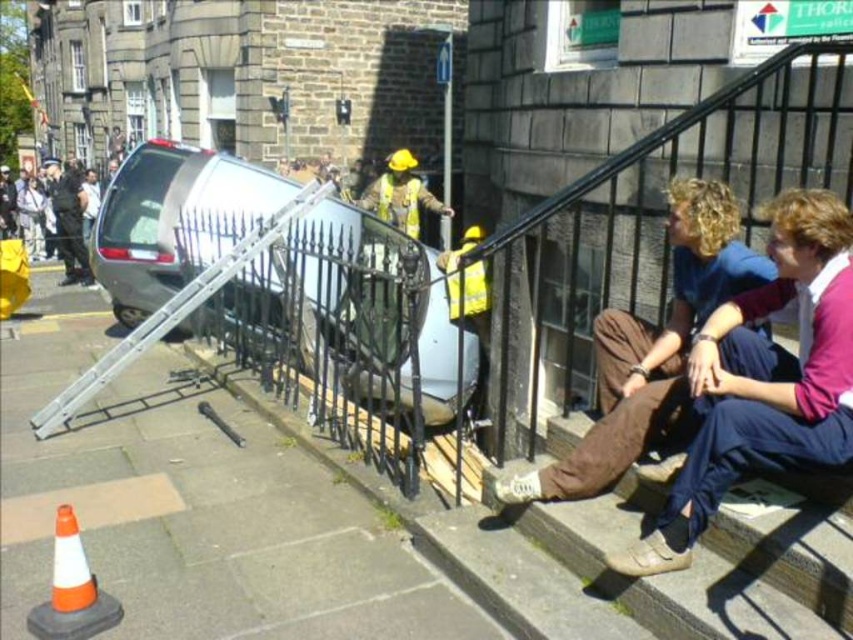
Question: In this image, where is brown fabric pants at lower right located relative to orange/white plastic traffic cone at lower left?

Choices:
 (A) below
 (B) above

Answer: (B)

Question: Which object is positioned farthest from the brown fabric pants at lower right?

Choices:
 (A) orange/white plastic traffic cone at lower left
 (B) brown fabric stairs at lower right
 (C) silver metallic van at center
 (D) dark blue uniform at center

Answer: (D)

Question: Which object is positioned closest to the silver metallic van at center?

Choices:
 (A) gray concrete pavement at lower left
 (B) dark blue uniform at center

Answer: (A)

Question: Which object is positioned farthest from the orange/white plastic traffic cone at lower left?

Choices:
 (A) gray concrete pavement at lower left
 (B) brown fabric pants at lower right
 (C) dark blue uniform at center

Answer: (C)

Question: Can you confirm if silver metallic van at center is positioned below dark blue uniform at center?

Choices:
 (A) yes
 (B) no

Answer: (A)

Question: Is gray concrete pavement at lower left above brown cotton pants at lower right?

Choices:
 (A) yes
 (B) no

Answer: (B)